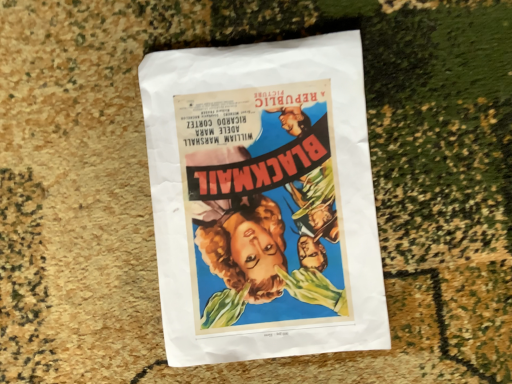
In order to click on vacant area on top of matte paper poster at center (from a real-world perspective) in this screenshot , I will do `click(266, 207)`.